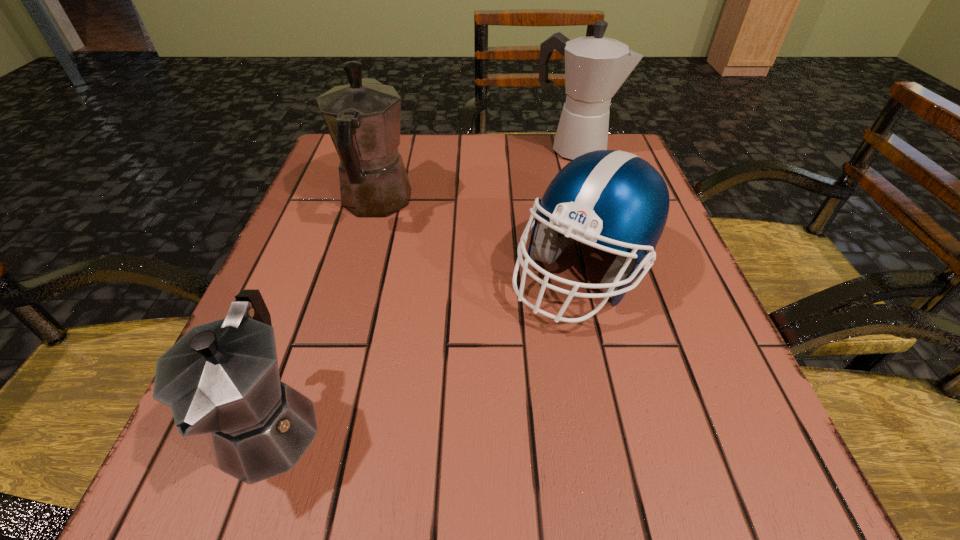
At what (x,y) coordinates should I click in order to perform the action: click on coffeepot that is the second closest to the football helmet. Please return your answer as a coordinate pair (x, y). The image size is (960, 540). Looking at the image, I should click on (595, 67).

The width and height of the screenshot is (960, 540). What are the coordinates of `coffeepot that stands as the closest to the shortest coffeepot` in the screenshot? It's located at (363, 118).

What are the coordinates of `blank space that satisfies the following two spatial constraints: 1. on the pouring side of the farthest object; 2. on the right side of the second nearest coffeepot` in the screenshot? It's located at (391, 150).

Where is `free space that satisfies the following two spatial constraints: 1. on the pouring side of the farthest coffeepot; 2. on the right side of the second farthest coffeepot`? The image size is (960, 540). free space that satisfies the following two spatial constraints: 1. on the pouring side of the farthest coffeepot; 2. on the right side of the second farthest coffeepot is located at coordinates (391, 150).